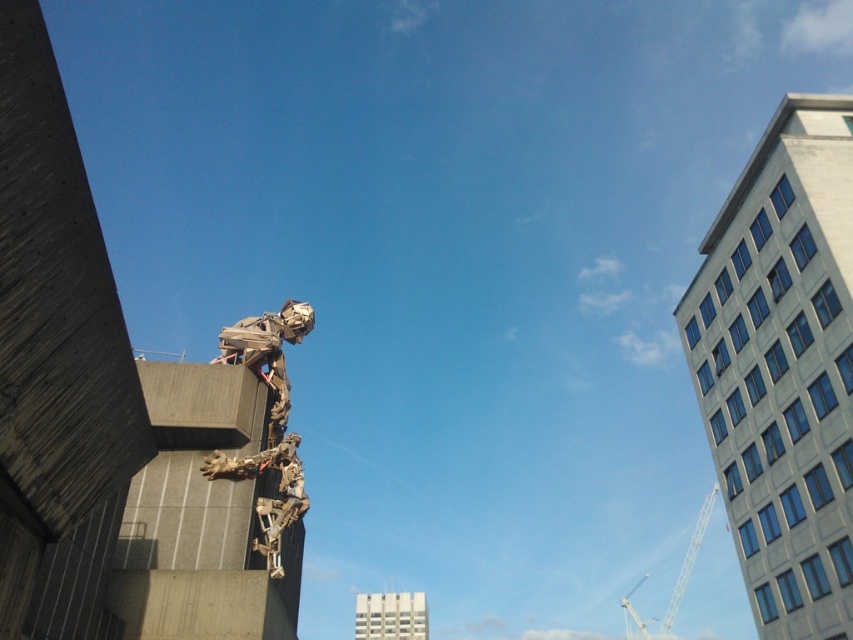
Looking at this image, you are standing in the urban scene depicted. You see two points marked in the image. The first point is at coordinate point [254,468] and the second is at point [685,566]. Which point is closer to you?

Point [254,468] is in front of point [685,566], so it is closer to you.

You are an architect designing a new city plaza and want to place a bench between the wooden sculpture at center and the metallic silver crane at upper right. Based on their positions, where should the bench be placed to ensure it is between both objects?

The bench should be placed below the wooden sculpture at center since it is above the metallic silver crane at upper right, so placing it in between would require positioning it lower than the sculpture but higher than the crane.

Based on the scene description, where is the wooden sculpture at center located in terms of its 2D coordinates?

The wooden sculpture at center is located at the 2D coordinates of point (268, 420).